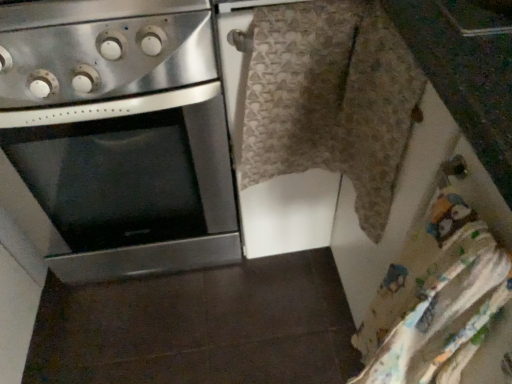
Measure the distance between stainless steel oven at left and camera.

24.12 inches.

Measure the distance between textured beige blanket at center and camera.

textured beige blanket at center is 21.22 inches away from camera.

Locate an element on the screen. This screenshot has width=512, height=384. stainless steel oven at left is located at coordinates (116, 137).

Considering the relative sizes of stainless steel oven at left and stainless steel gas stove at upper left in the image provided, is stainless steel oven at left smaller than stainless steel gas stove at upper left?

Incorrect, stainless steel oven at left is not smaller in size than stainless steel gas stove at upper left.

Considering the points (165, 198) and (67, 93), which point is behind, point (165, 198) or point (67, 93)?

The point (165, 198) is farther.

Is stainless steel oven at left oriented towards stainless steel gas stove at upper left?

No, stainless steel oven at left does not turn towards stainless steel gas stove at upper left.

From the image's perspective, which is below, stainless steel gas stove at upper left or textured beige blanket at center?

textured beige blanket at center appears lower in the image.

Does point (204, 23) come in front of point (258, 27)?

Yes.

From the picture: Is stainless steel gas stove at upper left outside of textured beige blanket at center?

That's correct, stainless steel gas stove at upper left is outside of textured beige blanket at center.

From a real-world perspective, which is physically above, stainless steel gas stove at upper left or textured beige blanket at center?

In real-world perspective, stainless steel gas stove at upper left is above.

Which of these two, textured beige blanket at center or stainless steel oven at left, is wider?

stainless steel oven at left is wider.

Looking at this image, which of these two, textured beige blanket at center or stainless steel oven at left, stands shorter?

textured beige blanket at center.

I want to click on blanket below the stainless steel oven at left (from the image's perspective), so click(x=330, y=99).

From a real-world perspective, is textured beige blanket at center under stainless steel oven at left?

No.

How different are the orientations of stainless steel gas stove at upper left and stainless steel oven at left in degrees?

There is a 0.000144-degree angle between the facing directions of stainless steel gas stove at upper left and stainless steel oven at left.

From the image's perspective, does stainless steel gas stove at upper left appear higher than stainless steel oven at left?

Yes, from the image's perspective, stainless steel gas stove at upper left is over stainless steel oven at left.

Is stainless steel gas stove at upper left to the left or to the right of stainless steel oven at left in the image?

From the image, it's evident that stainless steel gas stove at upper left is to the right of stainless steel oven at left.

From a real-world perspective, which object rests below the other?

In real-world perspective, stainless steel oven at left is lower.

Considering the sizes of textured beige blanket at center and stainless steel gas stove at upper left in the image, is textured beige blanket at center bigger or smaller than stainless steel gas stove at upper left?

Clearly, textured beige blanket at center is smaller in size than stainless steel gas stove at upper left.

Considering the sizes of objects textured beige blanket at center and stainless steel gas stove at upper left in the image provided, who is wider, textured beige blanket at center or stainless steel gas stove at upper left?

With larger width is stainless steel gas stove at upper left.

From the image's perspective, is textured beige blanket at center under stainless steel gas stove at upper left?

Yes.

Considering the relative positions of stainless steel oven at left and textured beige blanket at center in the image provided, is stainless steel oven at left to the right of textured beige blanket at center from the viewer's perspective?

No, stainless steel oven at left is not to the right of textured beige blanket at center.

The width and height of the screenshot is (512, 384). What are the coordinates of `blanket on the right side of stainless steel oven at left` in the screenshot? It's located at click(330, 99).

Could you tell me if stainless steel oven at left is turned towards textured beige blanket at center?

No, stainless steel oven at left is not oriented towards textured beige blanket at center.

At what (x,y) coordinates should I click in order to perform the action: click on oven below the stainless steel gas stove at upper left (from a real-world perspective). Please return your answer as a coordinate pair (x, y). Image resolution: width=512 pixels, height=384 pixels. Looking at the image, I should click on (116, 137).

Find the location of a particular element. The height and width of the screenshot is (384, 512). blanket that appears on the right of stainless steel gas stove at upper left is located at coordinates (330, 99).

When comparing their distances from textured beige blanket at center, does stainless steel gas stove at upper left or stainless steel oven at left seem closer?

stainless steel gas stove at upper left is closer to textured beige blanket at center.

Considering their positions, is stainless steel oven at left positioned closer to textured beige blanket at center than stainless steel gas stove at upper left?

stainless steel gas stove at upper left is closer to textured beige blanket at center.

Based on their spatial positions, is stainless steel oven at left or textured beige blanket at center closer to stainless steel gas stove at upper left?

Among the two, stainless steel oven at left is located nearer to stainless steel gas stove at upper left.

When comparing their distances from stainless steel oven at left, does textured beige blanket at center or stainless steel gas stove at upper left seem closer?

Based on the image, stainless steel gas stove at upper left appears to be nearer to stainless steel oven at left.

Based on the photo, estimate the real-world distances between objects in this image. Which object is further from stainless steel gas stove at upper left, textured beige blanket at center or stainless steel oven at left?

Among the two, textured beige blanket at center is located further to stainless steel gas stove at upper left.

Considering their positions, is stainless steel gas stove at upper left positioned closer to stainless steel oven at left than textured beige blanket at center?

stainless steel gas stove at upper left.

Identify the location of gas stove situated between stainless steel oven at left and textured beige blanket at center from left to right. Image resolution: width=512 pixels, height=384 pixels. (102, 49).